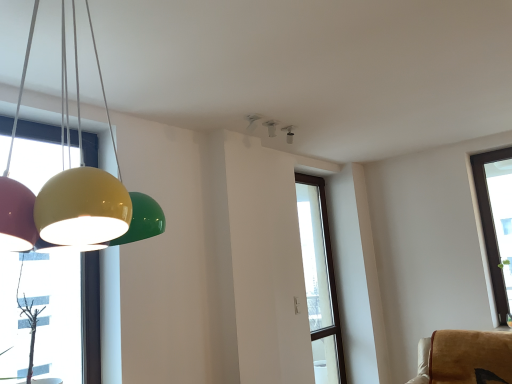
This screenshot has height=384, width=512. What are the coordinates of `white glossy light fixture at upper center, marked as the 1th lamp in a top-to-bottom arrangement` in the screenshot? It's located at (271, 127).

Identify the location of transparent glass window at center. (320, 279).

Does white glossy light fixture at upper center, marked as the 1th lamp in a top-to-bottom arrangement, have a lesser width compared to transparent glass window at center?

No.

Is transparent glass window at center completely or partially inside white glossy light fixture at upper center, marked as the 1th lamp in a top-to-bottom arrangement?

That's incorrect, transparent glass window at center is not inside white glossy light fixture at upper center, marked as the 1th lamp in a top-to-bottom arrangement.

From a real-world perspective, is white glossy light fixture at upper center, which ranks as the first lamp in back-to-front order, positioned under transparent glass window at center based on gravity?

No, from a real-world perspective, white glossy light fixture at upper center, which ranks as the first lamp in back-to-front order, is not beneath transparent glass window at center.

Find the location of a particular element. This screenshot has height=384, width=512. the 2nd lamp in front of the transparent glass window at center, starting your count from the anchor is located at coordinates (73, 188).

Could you tell me if glossy plastic lampshade at left, arranged as the first lamp when viewed from the left, is facing transparent glass window at center?

No, glossy plastic lampshade at left, arranged as the first lamp when viewed from the left, is not facing towards transparent glass window at center.

From a real-world perspective, which object stands above the other?

glossy plastic lampshade at left, placed as the 2th lamp when sorted from top to bottom, is physically above.

From the image's perspective, would you say glossy plastic lampshade at left, the 2th lamp viewed from the back, is shown under transparent glass window at center?

Actually, glossy plastic lampshade at left, the 2th lamp viewed from the back, appears above transparent glass window at center in the image.

Does transparent glass window at center come behind white glossy light fixture at upper center, marked as the first lamp in a right-to-left arrangement?

Yes, transparent glass window at center is further from the camera.

Is transparent glass window at center not close to white glossy light fixture at upper center, marked as the 1th lamp in a top-to-bottom arrangement?

transparent glass window at center is positioned a significant distance from white glossy light fixture at upper center, marked as the 1th lamp in a top-to-bottom arrangement.

Consider the image. Which object is positioned more to the left, transparent glass window at center or white glossy light fixture at upper center, which ranks as the first lamp in back-to-front order?

Positioned to the left is white glossy light fixture at upper center, which ranks as the first lamp in back-to-front order.

Considering the sizes of objects glossy plastic lampshade at left, arranged as the second lamp when viewed from the right, and white glossy light fixture at upper center, positioned as the second lamp in front-to-back order, in the image provided, who is taller, glossy plastic lampshade at left, arranged as the second lamp when viewed from the right, or white glossy light fixture at upper center, positioned as the second lamp in front-to-back order,?

glossy plastic lampshade at left, arranged as the second lamp when viewed from the right, is taller.

Considering the sizes of objects glossy plastic lampshade at left, arranged as the second lamp when viewed from the right, and white glossy light fixture at upper center, marked as the 1th lamp in a top-to-bottom arrangement, in the image provided, who is wider, glossy plastic lampshade at left, arranged as the second lamp when viewed from the right, or white glossy light fixture at upper center, marked as the 1th lamp in a top-to-bottom arrangement,?

Wider between the two is glossy plastic lampshade at left, arranged as the second lamp when viewed from the right.

Can you confirm if glossy plastic lampshade at left, the 1th lamp ordered from the bottom, is bigger than white glossy light fixture at upper center, marked as the 1th lamp in a top-to-bottom arrangement?

Correct, glossy plastic lampshade at left, the 1th lamp ordered from the bottom, is larger in size than white glossy light fixture at upper center, marked as the 1th lamp in a top-to-bottom arrangement.

Is glossy plastic lampshade at left, the 1th lamp ordered from the bottom, aimed at white glossy light fixture at upper center, positioned as the second lamp in front-to-back order?

No, glossy plastic lampshade at left, the 1th lamp ordered from the bottom, is not aimed at white glossy light fixture at upper center, positioned as the second lamp in front-to-back order.

Which object is wider, white glossy light fixture at upper center, marked as the first lamp in a right-to-left arrangement, or glossy plastic lampshade at left, the first lamp viewed from the front?

glossy plastic lampshade at left, the first lamp viewed from the front.

Looking at the image, does white glossy light fixture at upper center, positioned as the second lamp in front-to-back order, seem bigger or smaller compared to glossy plastic lampshade at left, the 2th lamp viewed from the back?

Considering their sizes, white glossy light fixture at upper center, positioned as the second lamp in front-to-back order, takes up less space than glossy plastic lampshade at left, the 2th lamp viewed from the back.

From a real-world perspective, between white glossy light fixture at upper center, positioned as the second lamp in front-to-back order, and glossy plastic lampshade at left, the first lamp viewed from the front, who is vertically higher?

In real-world perspective, white glossy light fixture at upper center, positioned as the second lamp in front-to-back order, is above.

Is there a large distance between white glossy light fixture at upper center, positioned as the second lamp in front-to-back order, and glossy plastic lampshade at left, the first lamp viewed from the front?

Absolutely, white glossy light fixture at upper center, positioned as the second lamp in front-to-back order, is distant from glossy plastic lampshade at left, the first lamp viewed from the front.

From a real-world perspective, is transparent glass window at center located beneath glossy plastic lampshade at left, arranged as the second lamp when viewed from the right?

Indeed, from a real-world perspective, transparent glass window at center is positioned beneath glossy plastic lampshade at left, arranged as the second lamp when viewed from the right.

From the picture: Considering the positions of objects transparent glass window at center and glossy plastic lampshade at left, the 2th lamp viewed from the back, in the image provided, who is in front, transparent glass window at center or glossy plastic lampshade at left, the 2th lamp viewed from the back,?

glossy plastic lampshade at left, the 2th lamp viewed from the back, is in front.

Is transparent glass window at center located outside glossy plastic lampshade at left, the 1th lamp ordered from the bottom?

Yes.

Which object is positioned more to the left, transparent glass window at center or glossy plastic lampshade at left, the 2th lamp viewed from the back?

From the viewer's perspective, glossy plastic lampshade at left, the 2th lamp viewed from the back, appears more on the left side.

The width and height of the screenshot is (512, 384). In the image, there is a white glossy light fixture at upper center, marked as the first lamp in a right-to-left arrangement. In order to click on window below it (from a real-world perspective) in this screenshot , I will do `click(320, 279)`.

The image size is (512, 384). What are the coordinates of `window behind the glossy plastic lampshade at left, the first lamp viewed from the front` in the screenshot? It's located at (320, 279).

Looking at the image, which one is located closer to glossy plastic lampshade at left, placed as the 2th lamp when sorted from top to bottom, white glossy light fixture at upper center, positioned as the second lamp in front-to-back order, or transparent glass window at center?

white glossy light fixture at upper center, positioned as the second lamp in front-to-back order, lies closer to glossy plastic lampshade at left, placed as the 2th lamp when sorted from top to bottom, than the other object.

From the image, which object appears to be nearer to transparent glass window at center, glossy plastic lampshade at left, the first lamp viewed from the front, or white glossy light fixture at upper center, marked as the second lamp in a left-to-right arrangement?

The object closer to transparent glass window at center is white glossy light fixture at upper center, marked as the second lamp in a left-to-right arrangement.

Based on their spatial positions, is transparent glass window at center or glossy plastic lampshade at left, the 2th lamp viewed from the back, further from white glossy light fixture at upper center, positioned as the second lamp in front-to-back order?

Among the two, glossy plastic lampshade at left, the 2th lamp viewed from the back, is located further to white glossy light fixture at upper center, positioned as the second lamp in front-to-back order.

Considering their positions, is white glossy light fixture at upper center, positioned as the second lamp in front-to-back order, positioned further to transparent glass window at center than glossy plastic lampshade at left, the 1th lamp ordered from the bottom?

glossy plastic lampshade at left, the 1th lamp ordered from the bottom, lies further to transparent glass window at center than the other object.

Based on the photo, estimate the real-world distances between objects in this image. Which object is further from glossy plastic lampshade at left, the 1th lamp ordered from the bottom, transparent glass window at center or white glossy light fixture at upper center, marked as the 1th lamp in a top-to-bottom arrangement?

The object further to glossy plastic lampshade at left, the 1th lamp ordered from the bottom, is transparent glass window at center.

Based on their spatial positions, is glossy plastic lampshade at left, the first lamp viewed from the front, or transparent glass window at center further from white glossy light fixture at upper center, marked as the 1th lamp in a top-to-bottom arrangement?

glossy plastic lampshade at left, the first lamp viewed from the front, lies further to white glossy light fixture at upper center, marked as the 1th lamp in a top-to-bottom arrangement, than the other object.

The image size is (512, 384). Find the location of `lamp positioned between glossy plastic lampshade at left, arranged as the first lamp when viewed from the left, and transparent glass window at center from near to far`. lamp positioned between glossy plastic lampshade at left, arranged as the first lamp when viewed from the left, and transparent glass window at center from near to far is located at coordinates (271, 127).